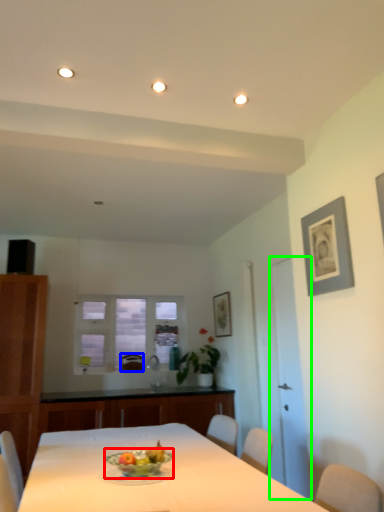
Question: Which object is positioned closest to glass bowl (highlighted by a red box)? Select from armchair (highlighted by a blue box) and glass door (highlighted by a green box).

Choices:
 (A) armchair
 (B) glass door

Answer: (B)